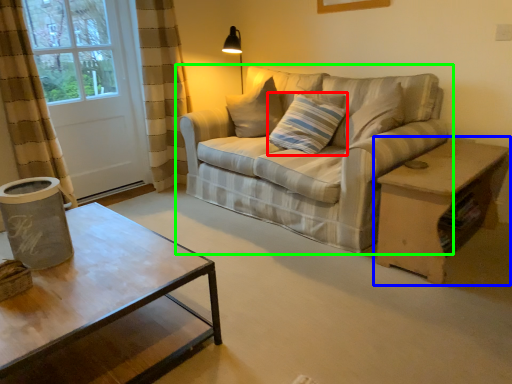
Question: Estimate the real-world distances between objects in this image. Which object is farther from pillow (highlighted by a red box), table (highlighted by a blue box) or studio couch (highlighted by a green box)?

Choices:
 (A) table
 (B) studio couch

Answer: (A)